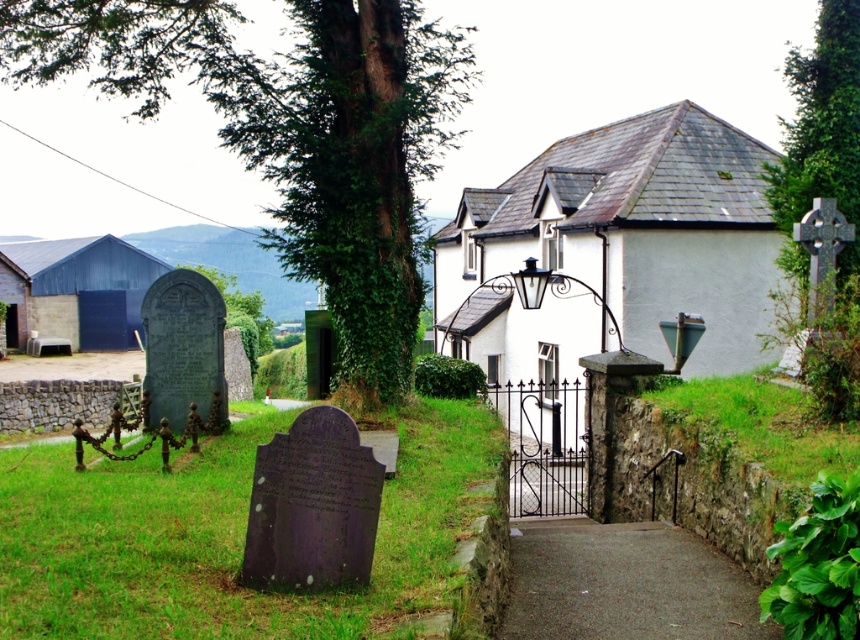
Who is lower down, green ivy-covered tree at center-left or green ivy-covered tree at upper right?

green ivy-covered tree at center-left is below.

How distant is green ivy-covered tree at center-left from green ivy-covered tree at upper right?

They are 20.60 meters apart.

Image resolution: width=860 pixels, height=640 pixels. Find the location of `green ivy-covered tree at center-left`. green ivy-covered tree at center-left is located at coordinates (293, 131).

Is point (533, 582) positioned behind point (822, 163)?

No, it is not.

At what (x,y) coordinates should I click in order to perform the action: click on gravel path at center. Please return your answer as a coordinate pair (x, y). The width and height of the screenshot is (860, 640). Looking at the image, I should click on (624, 584).

Identify the location of gravel path at center. (624, 584).

Between green ivy-covered tree at center-left and gravel path at center, which one is positioned higher?

green ivy-covered tree at center-left is higher up.

Is point (376, 348) farther from camera compared to point (559, 547)?

That is True.

Where is `green ivy-covered tree at center-left`? This screenshot has width=860, height=640. green ivy-covered tree at center-left is located at coordinates (293, 131).